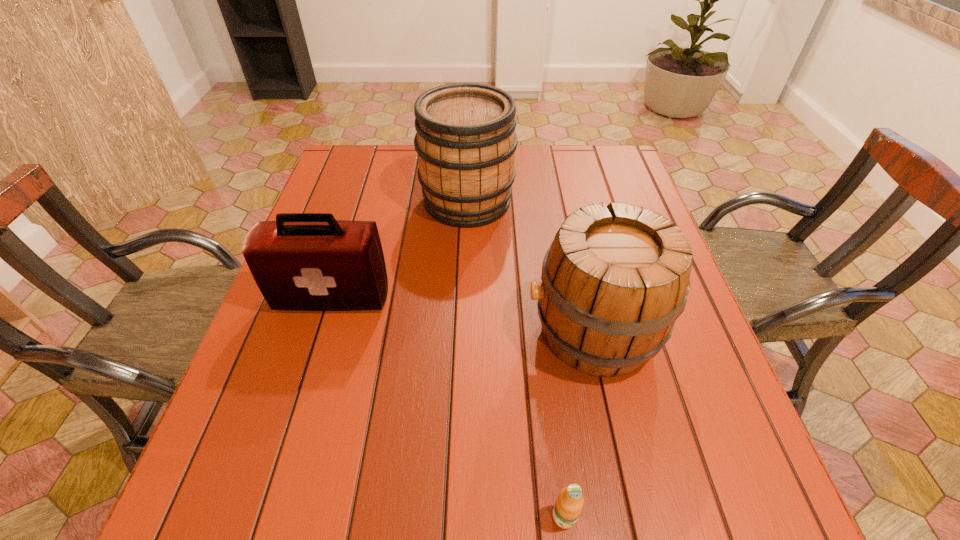
Find the location of a particular element. This screenshot has width=960, height=540. the left cider is located at coordinates (466, 141).

Identify the location of the third object from right to left. (466, 141).

Where is `the nearer cider`? the nearer cider is located at coordinates (614, 280).

Where is `the first aid kit`? This screenshot has width=960, height=540. the first aid kit is located at coordinates (302, 261).

This screenshot has height=540, width=960. I want to click on the shortest object, so click(569, 503).

At what (x,y) coordinates should I click in order to perform the action: click on orange juice. Please return your answer as a coordinate pair (x, y). The image size is (960, 540). Looking at the image, I should click on (x=569, y=503).

Locate an element on the screen. free space located 0.150m on the right of the left cider is located at coordinates (567, 201).

At what (x,y) coordinates should I click in order to perform the action: click on vacant space located on the side of the nearer cider where the spigot is located. Please return your answer as a coordinate pair (x, y). Looking at the image, I should click on (335, 332).

Identify the location of vacant space located on the side of the nearer cider where the spigot is located. This screenshot has height=540, width=960. (393, 332).

The height and width of the screenshot is (540, 960). In order to click on vacant space situated 0.330m on the side of the nearer cider where the spigot is located in this screenshot , I will do pos(369,332).